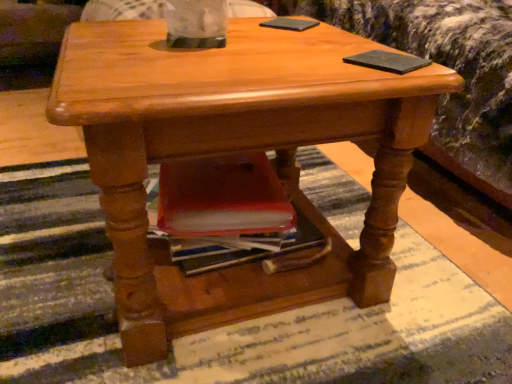
In order to click on free space to the left of black matte pad at upper right, positioned as the second pad in top-to-bottom order in this screenshot , I will do `click(287, 61)`.